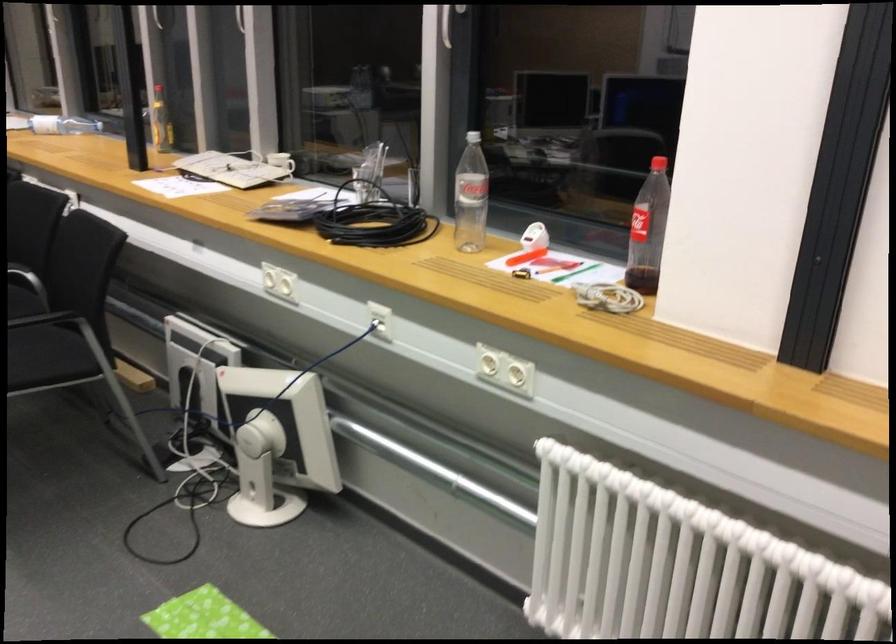
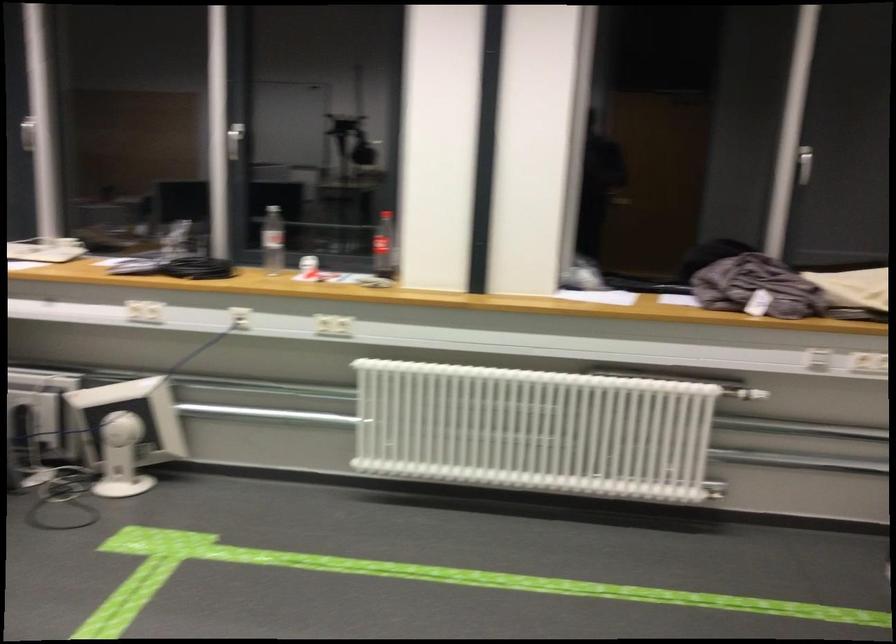
The point at (259, 438) is marked in the first image. Where is the corresponding point in the second image?

(126, 431)